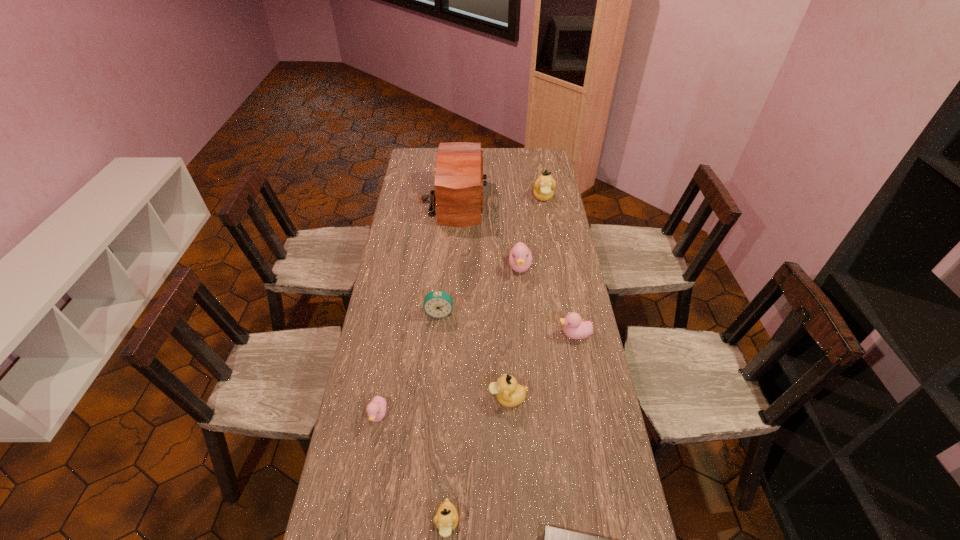
The height and width of the screenshot is (540, 960). Identify the location of vacant space at the far right corner of the desktop. (538, 156).

Locate an element on the screen. This screenshot has width=960, height=540. free space between the tallest object and the smallest pink duckling is located at coordinates (416, 308).

Identify the location of free space between the second smallest tan duckling and the fourth farthest object. This screenshot has height=540, width=960. (473, 355).

The width and height of the screenshot is (960, 540). What are the coordinates of `empty space between the farthest duckling and the second tan duckling from left to right` in the screenshot? It's located at (525, 298).

The width and height of the screenshot is (960, 540). What are the coordinates of `empty space between the alarm clock and the radio receiver` in the screenshot? It's located at (446, 257).

This screenshot has width=960, height=540. I want to click on vacant area between the biggest tan duckling and the nearest pink duckling, so click(x=461, y=306).

Identify the location of vacant area that lies between the tallest object and the blue alarm clock. (446, 257).

Locate an element on the screen. This screenshot has height=540, width=960. the second closest object to the nearest tan duckling is located at coordinates (376, 409).

Find the location of a particular element. object that is the sixth closest one to the farthest tan duckling is located at coordinates (376, 409).

At what (x,y) coordinates should I click in order to perform the action: click on the fourth closest duckling to the radio receiver. Please return your answer as a coordinate pair (x, y). The image size is (960, 540). Looking at the image, I should click on (509, 393).